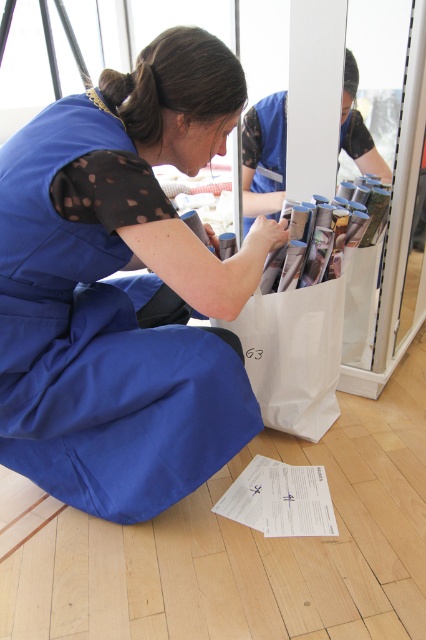
You are a healthcare worker in the scene and need to retrieve the white paper bag at lower center. Is the white paper at lower center blocking your access to it?

The white paper bag at lower center is above the white paper at lower center, so the white paper at lower center is not blocking access to the white paper bag at lower center.

You are a healthcare worker who needs to reach the white paper at lower center while standing on the blue fabric dress at center. Can you comfortably reach it without moving your feet?

The distance between the blue fabric dress at center and the white paper at lower center is 19.45 inches. Since this distance is within typical comfortable reaching range for most adults, you can likely reach it without moving your feet.